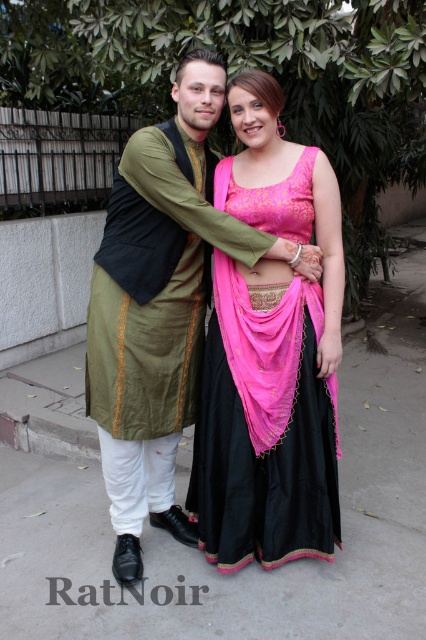
Is point (244, 618) in front of point (290, 515)?

Yes.

Is gray concrete pavement at center behind pink satin lehenga at center?

No, gray concrete pavement at center is in front of pink satin lehenga at center.

This screenshot has height=640, width=426. I want to click on gray concrete pavement at center, so click(x=199, y=552).

You are a GUI agent. You are given a task and a screenshot of the screen. Output one action in this format:
    pyautogui.click(x=<x>, y=<y>)
    Task: Click on the gray concrete pavement at center
    This screenshot has height=640, width=426.
    Given the screenshot: What is the action you would take?
    pyautogui.click(x=199, y=552)